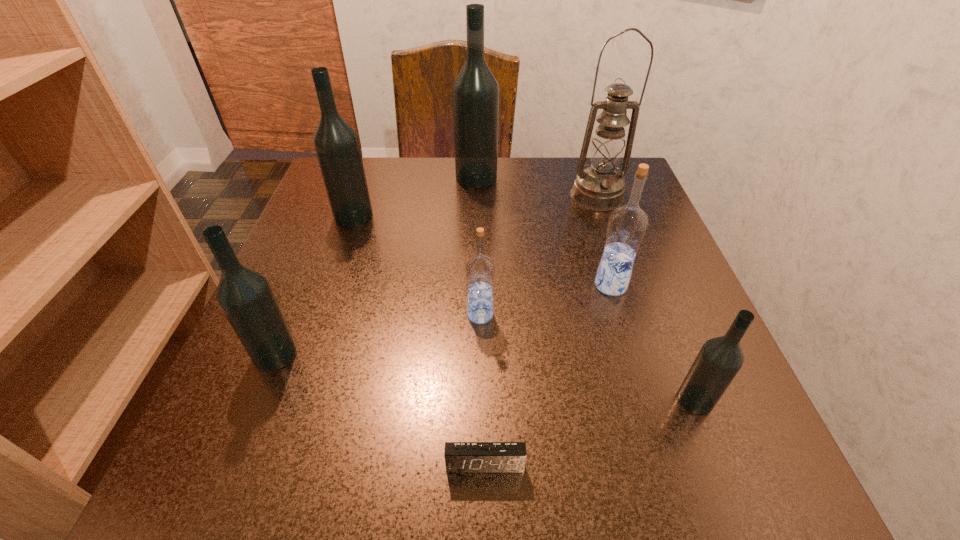
Where is `vacant area between the farther blue vodka and the smallest black vodka`? The width and height of the screenshot is (960, 540). vacant area between the farther blue vodka and the smallest black vodka is located at coordinates 653,342.

Where is `object that ranks as the closest to the fifth farthest vodka`? The image size is (960, 540). object that ranks as the closest to the fifth farthest vodka is located at coordinates (480, 270).

Identify which object is the third nearest to the bigger blue vodka. Please provide its 2D coordinates. Your answer should be formatted as a tuple, i.e. [(x, y)], where the tuple contains the x and y coordinates of a point satisfying the conditions above.

[(599, 187)]

Choose which vodka is the nearest neighbor to the fifth vodka from left to right. Please provide its 2D coordinates. Your answer should be formatted as a tuple, i.e. [(x, y)], where the tuple contains the x and y coordinates of a point satisfying the conditions above.

[(719, 360)]

Locate which vodka is the closest to the fifth farthest vodka. Please provide its 2D coordinates. Your answer should be formatted as a tuple, i.e. [(x, y)], where the tuple contains the x and y coordinates of a point satisfying the conditions above.

[(480, 270)]

The image size is (960, 540). What are the coordinates of `black vodka that stands as the closest to the farther blue vodka` in the screenshot? It's located at (719, 360).

Select which black vodka appears as the second closest to the third nearest black vodka. Please provide its 2D coordinates. Your answer should be formatted as a tuple, i.e. [(x, y)], where the tuple contains the x and y coordinates of a point satisfying the conditions above.

[(245, 296)]

In order to click on blank area in the image that satisfies the following two spatial constraints: 1. on the back side of the right blue vodka; 2. on the right side of the fifth farthest vodka in this screenshot , I will do `click(303, 285)`.

Locate an element on the screen. blank space that satisfies the following two spatial constraints: 1. on the front side of the fifth vodka from left to right; 2. on the right side of the biggest black vodka is located at coordinates (475, 285).